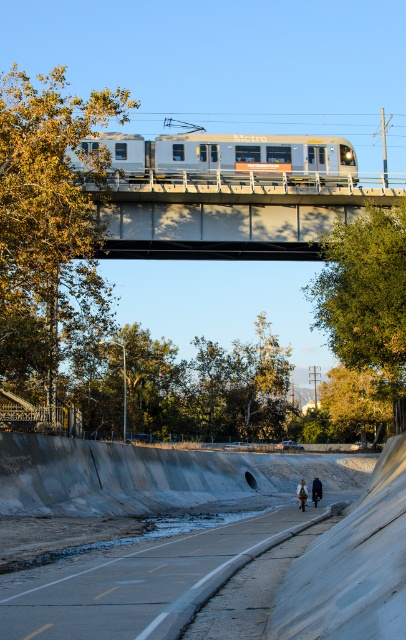
You are standing on the paved path below the bridge and want to reach a point closer to you. Which of the two points, point (332, 220) or point (291, 161), should you head towards?

You should head towards point (332, 220) because it is closer to the viewer than point (291, 161).